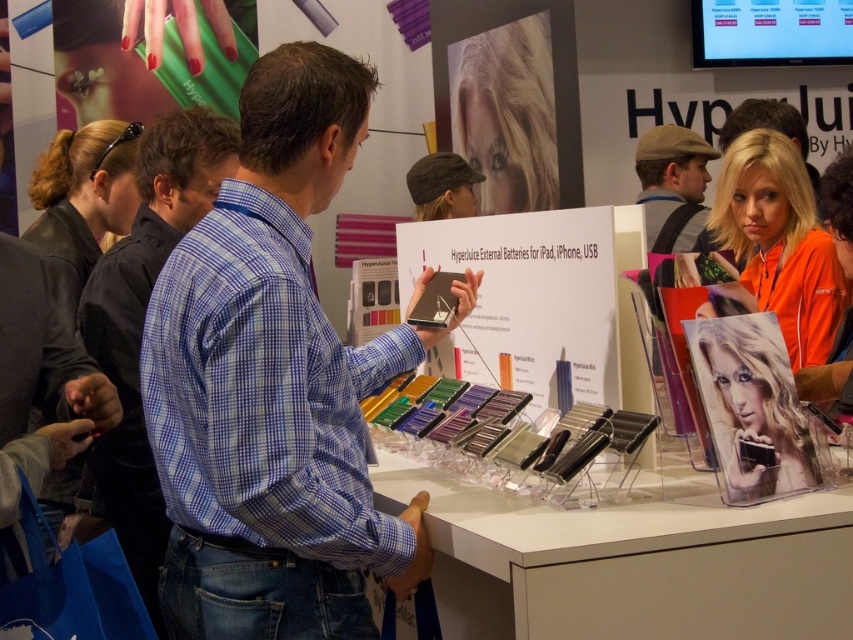
Question: Is blue checkered shirt at center bigger than brown leather jacket at upper left?

Choices:
 (A) no
 (B) yes

Answer: (B)

Question: Based on their relative distances, which object is nearer to the blonde hair at upper right?

Choices:
 (A) blue plaid shirt at center
 (B) blonde hair at center
 (C) khaki wool cap at upper right
 (D) brown leather jacket at upper left

Answer: (B)

Question: Which object appears farthest from the camera in this image?

Choices:
 (A) brown leather jacket at upper left
 (B) blue plaid shirt at center

Answer: (A)

Question: Which point is closer to the camera?

Choices:
 (A) (143, 588)
 (B) (782, 212)
 (C) (234, 282)

Answer: (C)

Question: Can you confirm if blue plaid shirt at center is positioned to the right of brown leather jacket at upper left?

Choices:
 (A) yes
 (B) no

Answer: (A)

Question: Observing the image, what is the correct spatial positioning of brown leather jacket at upper left in reference to khaki wool cap at upper right?

Choices:
 (A) right
 (B) left

Answer: (B)